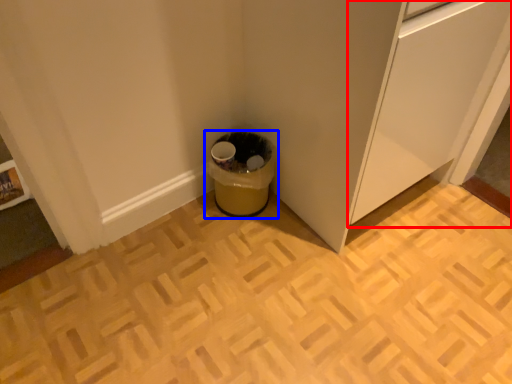
Question: Which of the following is the closest to the observer, cabinetry (highlighted by a red box) or waste container (highlighted by a blue box)?

Choices:
 (A) cabinetry
 (B) waste container

Answer: (A)